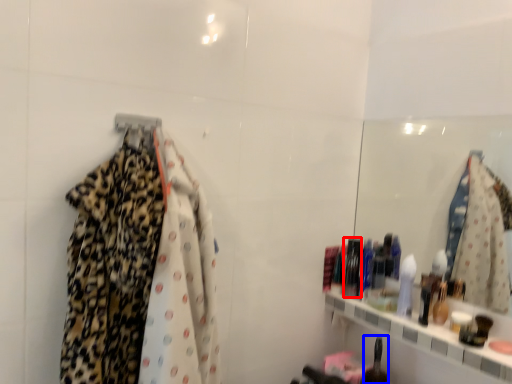
Question: Which object is further to the camera taking this photo, toiletry (highlighted by a red box) or toiletry (highlighted by a blue box)?

Choices:
 (A) toiletry
 (B) toiletry

Answer: (A)